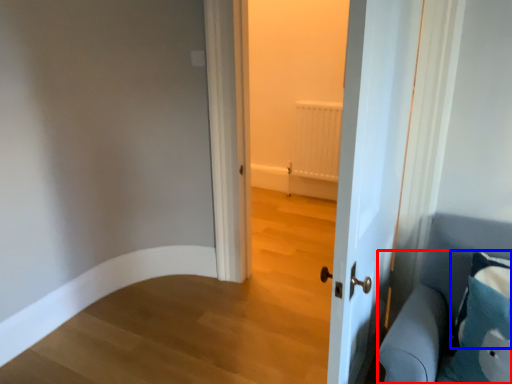
Question: Which object appears closest to the camera in this image, furniture (highlighted by a red box) or pillow (highlighted by a blue box)?

Choices:
 (A) furniture
 (B) pillow

Answer: (A)